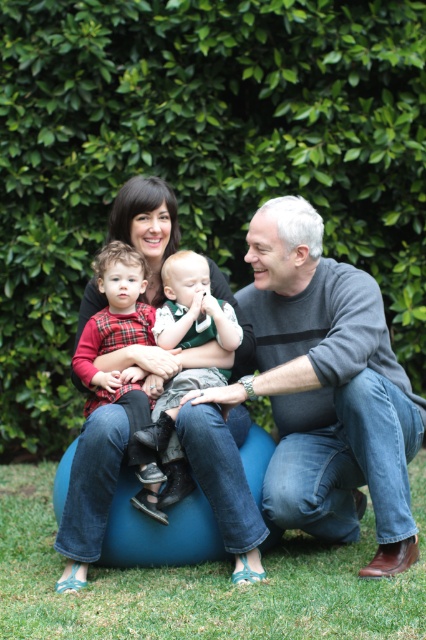
Is green leafy hedge at upper center behind matte black sweater at center?

That is True.

Is point (149, 38) farther from viewer compared to point (144, 252)?

Yes, it is behind point (144, 252).

Identify the location of green leafy hedge at upper center. This screenshot has height=640, width=426. (198, 156).

How far apart are plaid fabric baby at center and soft green fabric baby at center?

plaid fabric baby at center and soft green fabric baby at center are 7.86 inches apart.

Is point (137, 445) positioned after point (169, 438)?

No, it is in front of (169, 438).

Who is more distant from viewer, (123, 380) or (209, 276)?

Positioned behind is point (209, 276).

This screenshot has height=640, width=426. Find the location of `plaid fabric baby at center`. plaid fabric baby at center is located at coordinates (120, 348).

Which is behind, point (244, 180) or point (166, 305)?

Positioned behind is point (244, 180).

Which is more to the left, green leafy hedge at upper center or soft green fabric baby at center?

From the viewer's perspective, green leafy hedge at upper center appears more on the left side.

Is point (66, 90) behind point (210, 307)?

Yes, it is behind point (210, 307).

This screenshot has height=640, width=426. In order to click on green leafy hedge at upper center in this screenshot , I will do point(198,156).